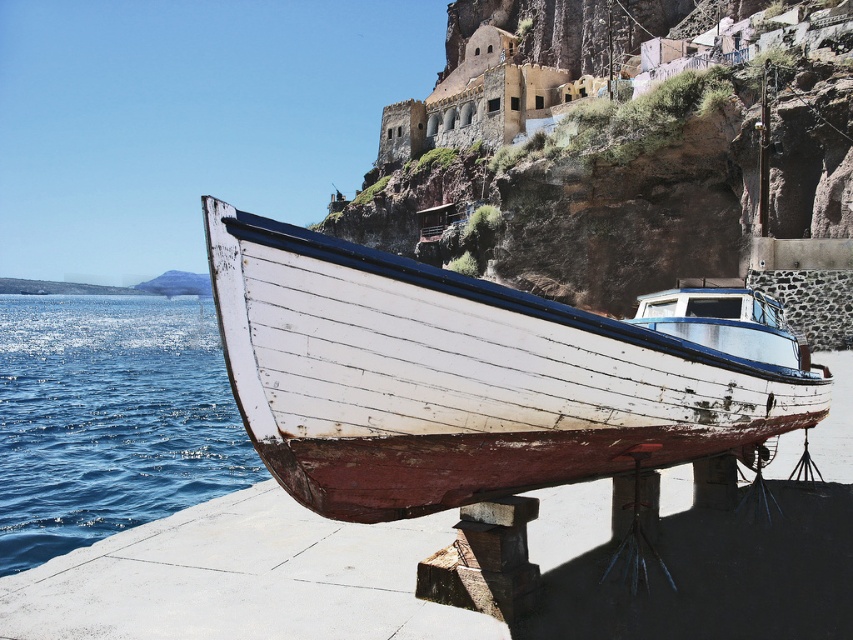
Does white wooden boat at center have a lesser width compared to white wood water at lower left?

Yes.

Who is more forward, (698, 333) or (13, 454)?

Point (698, 333) is in front.

Is point (479, 458) positioned in front of point (138, 424)?

Yes, point (479, 458) is closer to viewer.

Locate an element on the screen. This screenshot has height=640, width=853. white wooden boat at center is located at coordinates (479, 374).

Does white wood water at lower left appear over blue water at lower left?

Indeed, white wood water at lower left is positioned over blue water at lower left.

You are a GUI agent. You are given a task and a screenshot of the screen. Output one action in this format:
    pyautogui.click(x=<x>, y=<y>)
    Task: Click on the white wood water at lower left
    The height and width of the screenshot is (640, 853).
    Given the screenshot: What is the action you would take?
    pyautogui.click(x=109, y=419)

Looking at this image, can you confirm if white wooden boat at center is positioned to the right of blue water at lower left?

Correct, you'll find white wooden boat at center to the right of blue water at lower left.

Can you confirm if white wooden boat at center is shorter than blue water at lower left?

Yes, white wooden boat at center is shorter than blue water at lower left.

Is point (828, 372) closer to viewer compared to point (88, 484)?

Yes, it is.

The width and height of the screenshot is (853, 640). What are the coordinates of `white wooden boat at center` in the screenshot? It's located at (479, 374).